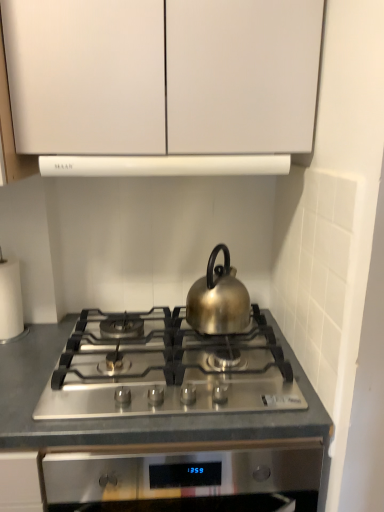
The width and height of the screenshot is (384, 512). Identify the location of vacant point to the right of white paper at left. (49, 333).